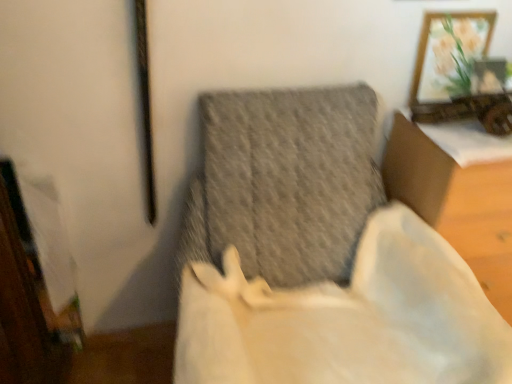
Question: Is white fabric cushion at center, the first furniture from the right, in front of wooden framed artwork at upper right?

Choices:
 (A) no
 (B) yes

Answer: (B)

Question: From a real-world perspective, is white fabric cushion at center, acting as the second furniture starting from the left, on top of wooden framed artwork at upper right?

Choices:
 (A) yes
 (B) no

Answer: (B)

Question: From a real-world perspective, is white fabric cushion at center, the first furniture from the right, physically below wooden framed artwork at upper right?

Choices:
 (A) yes
 (B) no

Answer: (A)

Question: Can you confirm if white fabric cushion at center, acting as the second furniture starting from the left, is taller than wooden framed artwork at upper right?

Choices:
 (A) yes
 (B) no

Answer: (A)

Question: Considering the relative positions of white fabric cushion at center, the first furniture from the right, and wooden framed artwork at upper right in the image provided, is white fabric cushion at center, the first furniture from the right, to the left of wooden framed artwork at upper right from the viewer's perspective?

Choices:
 (A) yes
 (B) no

Answer: (B)

Question: In terms of size, does textured gray cushion at center, the second furniture viewed from the right, appear bigger or smaller than white fabric cushion at center, acting as the second furniture starting from the left?

Choices:
 (A) small
 (B) big

Answer: (B)

Question: Which is correct: textured gray cushion at center, the first furniture from the left, is inside white fabric cushion at center, the first furniture from the right, or outside of it?

Choices:
 (A) inside
 (B) outside

Answer: (B)

Question: From their relative heights in the image, would you say textured gray cushion at center, the second furniture viewed from the right, is taller or shorter than white fabric cushion at center, the first furniture from the right?

Choices:
 (A) tall
 (B) short

Answer: (A)

Question: From a real-world perspective, is textured gray cushion at center, the second furniture viewed from the right, positioned above or below white fabric cushion at center, acting as the second furniture starting from the left?

Choices:
 (A) below
 (B) above

Answer: (B)

Question: Relative to wooden framed artwork at upper right, is textured gray cushion at center, the first furniture from the left, in front or behind?

Choices:
 (A) front
 (B) behind

Answer: (A)

Question: In terms of height, does textured gray cushion at center, the second furniture viewed from the right, look taller or shorter compared to wooden framed artwork at upper right?

Choices:
 (A) tall
 (B) short

Answer: (A)

Question: Based on their sizes in the image, would you say textured gray cushion at center, the first furniture from the left, is bigger or smaller than wooden framed artwork at upper right?

Choices:
 (A) small
 (B) big

Answer: (B)

Question: In terms of width, does textured gray cushion at center, the second furniture viewed from the right, look wider or thinner when compared to wooden framed artwork at upper right?

Choices:
 (A) wide
 (B) thin

Answer: (A)

Question: Looking at their shapes, would you say wooden framed artwork at upper right is wider or thinner than textured gray cushion at center, the first furniture from the left?

Choices:
 (A) thin
 (B) wide

Answer: (A)

Question: From a real-world perspective, relative to textured gray cushion at center, the first furniture from the left, is wooden framed artwork at upper right vertically above or below?

Choices:
 (A) above
 (B) below

Answer: (A)